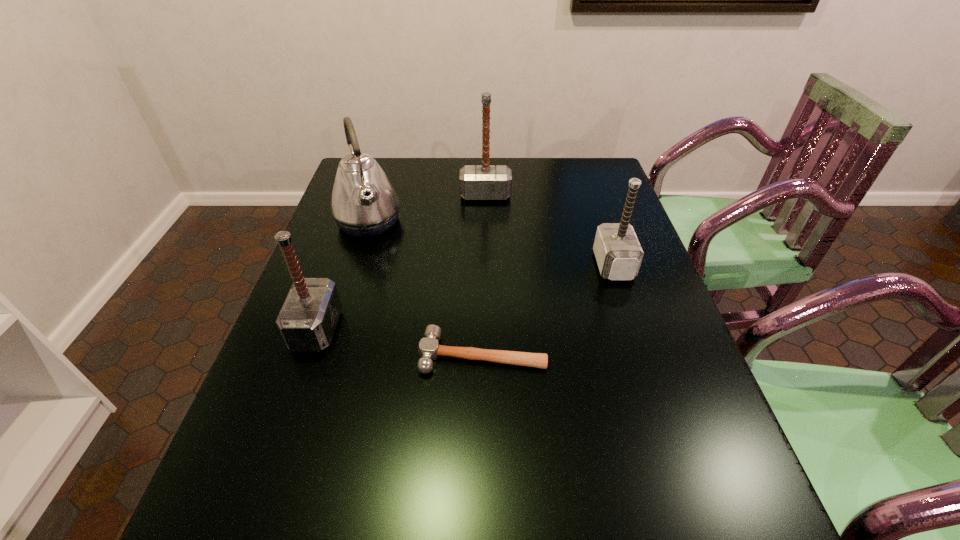
The image size is (960, 540). What are the coordinates of `the farthest hammer` in the screenshot? It's located at (481, 182).

You are a GUI agent. You are given a task and a screenshot of the screen. Output one action in this format:
    pyautogui.click(x=<x>, y=<y>)
    Task: Click on the kettle
    The height and width of the screenshot is (540, 960).
    Given the screenshot: What is the action you would take?
    pyautogui.click(x=364, y=203)

The height and width of the screenshot is (540, 960). Find the location of `the leftmost hammer`. the leftmost hammer is located at coordinates (307, 321).

What are the coordinates of `the rightmost hammer` in the screenshot? It's located at (618, 253).

Locate an element on the screen. the second farthest hammer is located at coordinates (618, 253).

You are a GUI agent. You are given a task and a screenshot of the screen. Output one action in this format:
    pyautogui.click(x=<x>, y=<y>)
    Task: Click on the shortest hammer
    The image size is (960, 540).
    Given the screenshot: What is the action you would take?
    pyautogui.click(x=429, y=349)

At what (x,y) coordinates should I click in order to perform the action: click on free space located 0.160m on the striking surface of the tallest hammer. Please return your answer as a coordinate pair (x, y). Image resolution: width=960 pixels, height=540 pixels. Looking at the image, I should click on (486, 234).

Locate an element on the screen. vacant point located on the right of the kettle is located at coordinates (517, 222).

Where is `vacant space located on the right of the leftmost hammer`? The image size is (960, 540). vacant space located on the right of the leftmost hammer is located at coordinates (462, 329).

In order to click on free point located 0.270m for striking with the head of the second farthest hammer in this screenshot , I will do `click(496, 265)`.